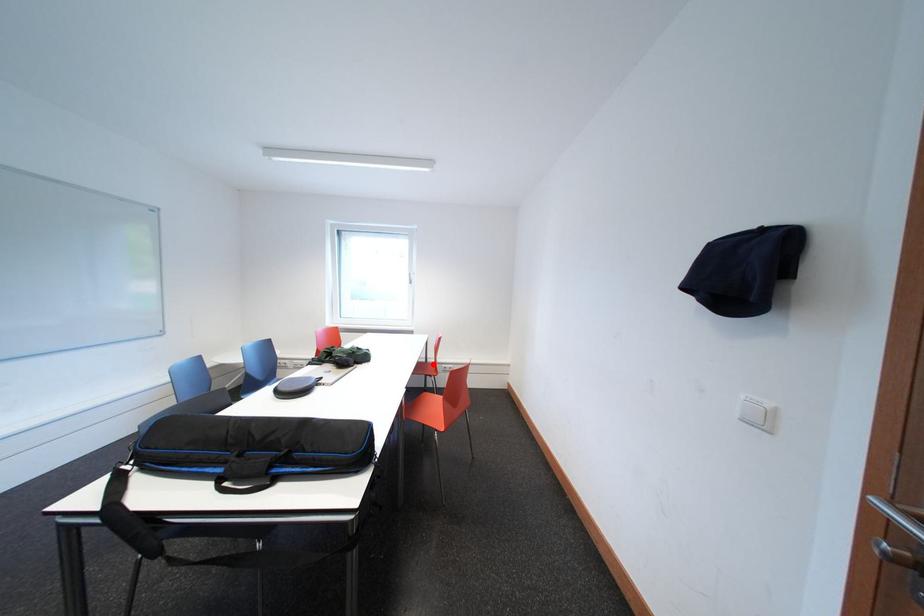
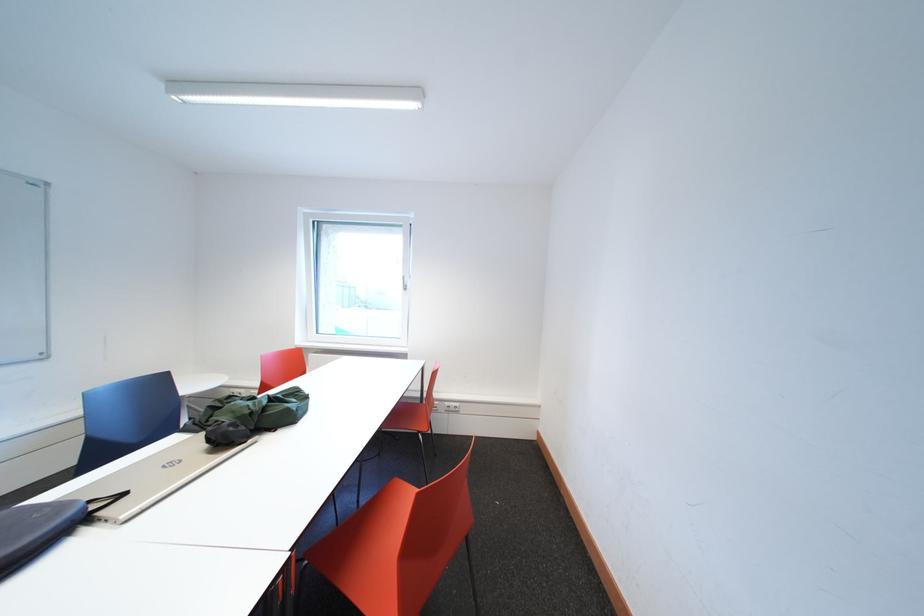
Locate, in the second image, the point that corresponds to the highlighted location in the first image.

(429, 400)